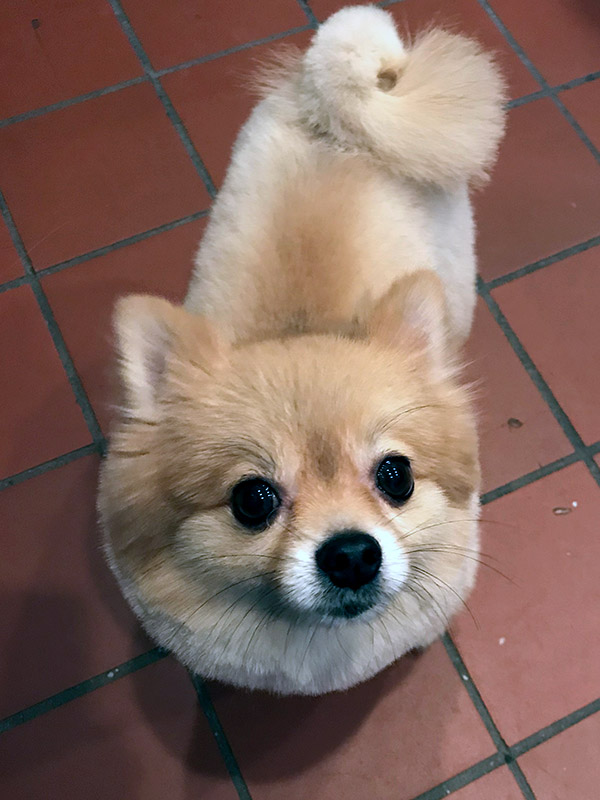
Locate an element on the screen. The width and height of the screenshot is (600, 800). floor is located at coordinates (349, 720).